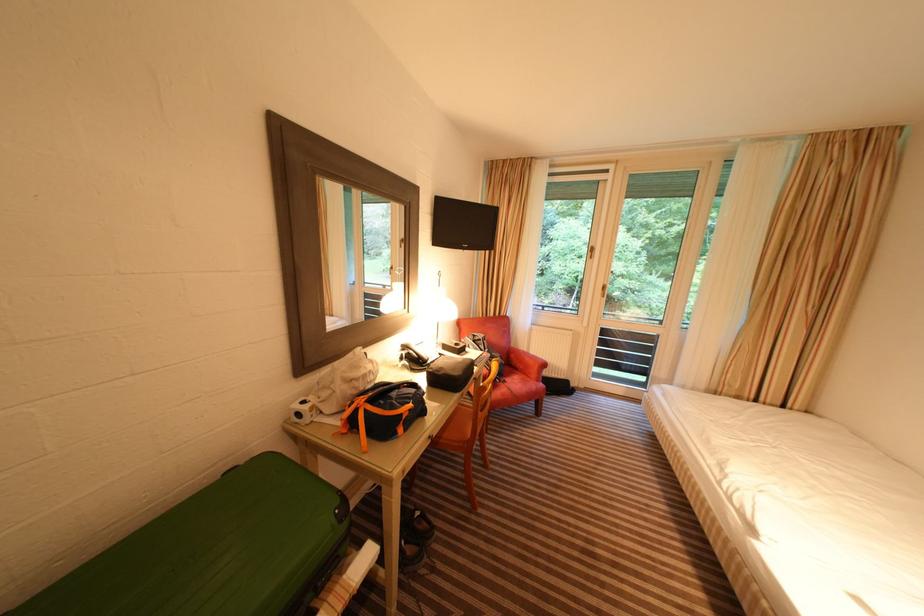
The width and height of the screenshot is (924, 616). Describe the element at coordinates (468, 427) in the screenshot. I see `the wooden chair sitting surface` at that location.